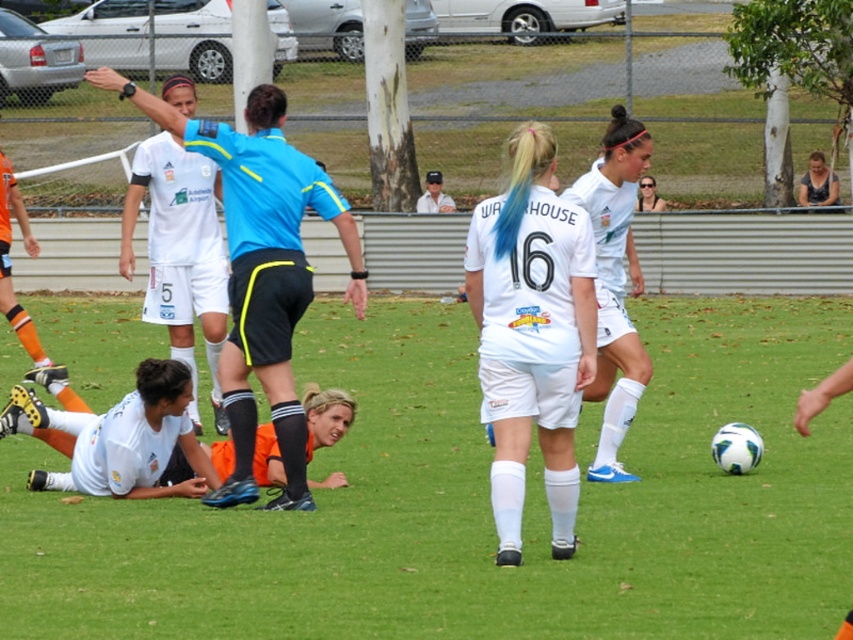
Can you confirm if white matte soccer ball at center is wider than blue short-sleeved shirt at upper center?

Indeed, white matte soccer ball at center has a greater width compared to blue short-sleeved shirt at upper center.

Who is more forward, (285,593) or (244,330)?

Point (285,593) is in front.

Image resolution: width=853 pixels, height=640 pixels. Identify the location of white matte soccer ball at center. (480, 502).

Locate an element on the screen. The image size is (853, 640). white matte jersey at upper left is located at coordinates (180, 253).

Which is more to the right, white matte jersey at upper left or white cap at center?

Positioned to the right is white cap at center.

Is point (209, 298) closer to camera compared to point (418, 211)?

That is True.

Find the location of `white matte jersey at upper left`. white matte jersey at upper left is located at coordinates (180, 253).

Consider the image. Between white matte soccer ball at center and white matte jersey at upper left, which one has less height?

white matte soccer ball at center

Is white matte soccer ball at center thinner than white matte jersey at upper left?

Incorrect, white matte soccer ball at center's width is not less than white matte jersey at upper left's.

Between point (105, 340) and point (180, 90), which one is positioned in front?

Point (180, 90)

Locate an element on the screen. This screenshot has width=853, height=640. white matte soccer ball at center is located at coordinates (480, 502).